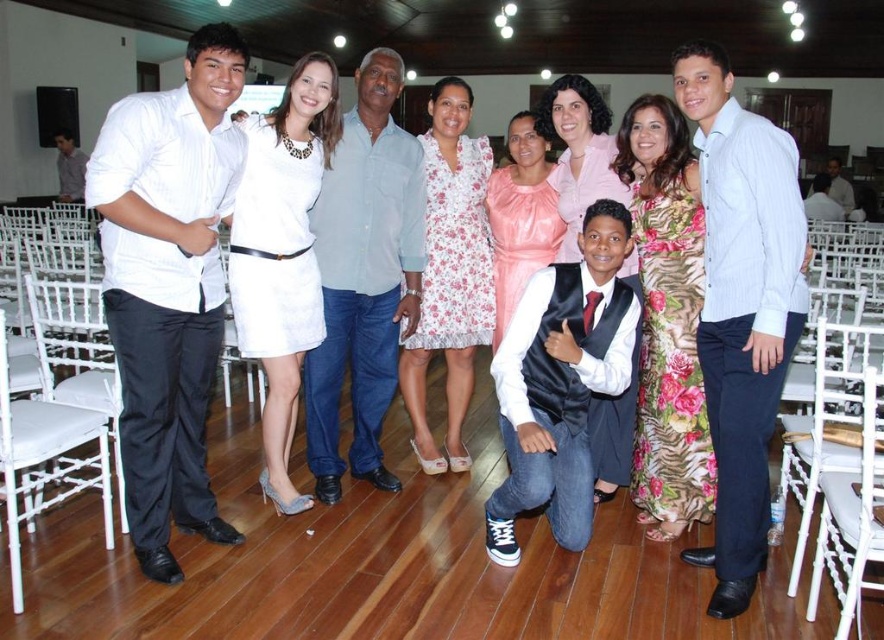
Question: Is white satin vest at center to the left of white satin dress at center from the viewer's perspective?

Choices:
 (A) yes
 (B) no

Answer: (A)

Question: Does light blue denim jeans at center have a larger size compared to white wood chair at lower right?

Choices:
 (A) yes
 (B) no

Answer: (A)

Question: Which is nearer to the floral fabric dress at center?

Choices:
 (A) white satin vest at center
 (B) floral dress at center

Answer: (B)

Question: Based on their relative distances, which object is nearer to the floral fabric dress at center?

Choices:
 (A) white satin vest at center
 (B) light blue shirt at center

Answer: (A)

Question: Is white smooth shirt at left thinner than white satin vest at center?

Choices:
 (A) no
 (B) yes

Answer: (B)

Question: Estimate the real-world distances between objects in this image. Which object is closer to the light blue denim jeans at center?

Choices:
 (A) white smooth shirt at left
 (B) light blue shirt at center
 (C) pink satin blouse at center

Answer: (A)